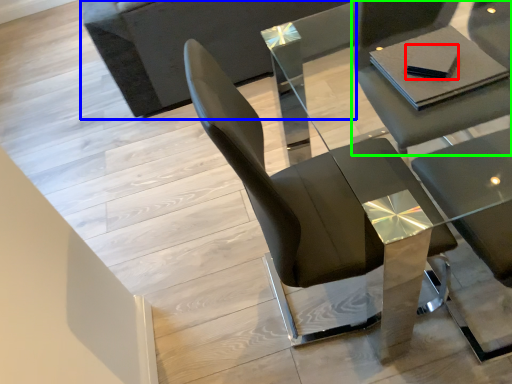
Question: Which object is positioned farthest from pad (highlighted by a red box)? Select from couch (highlighted by a blue box) and chair (highlighted by a green box).

Choices:
 (A) couch
 (B) chair

Answer: (A)